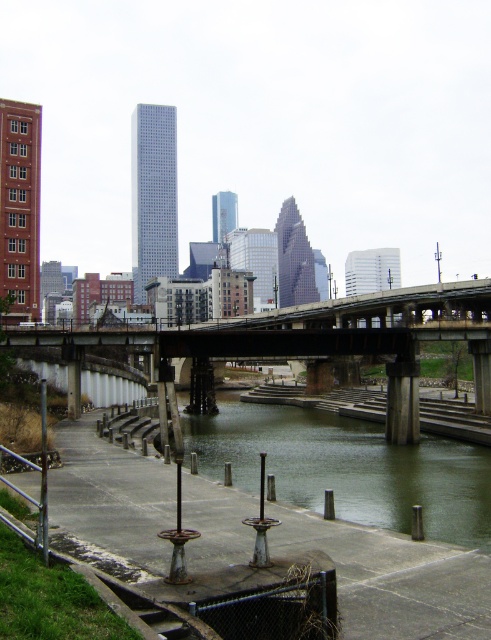
Question: Is green concrete river at center behind concrete bridge at center?

Choices:
 (A) yes
 (B) no

Answer: (B)

Question: Observing the image, what is the correct spatial positioning of green concrete river at center in reference to concrete bridge at center?

Choices:
 (A) right
 (B) left

Answer: (B)

Question: Can you confirm if green concrete river at center is smaller than concrete bridge at center?

Choices:
 (A) no
 (B) yes

Answer: (B)

Question: Which point is closer to the camera?

Choices:
 (A) green concrete river at center
 (B) concrete bridge at center

Answer: (A)

Question: Which point is farther to the camera?

Choices:
 (A) (409, 317)
 (B) (430, 474)

Answer: (A)

Question: Among these points, which one is nearest to the camera?

Choices:
 (A) (354, 490)
 (B) (327, 310)

Answer: (A)